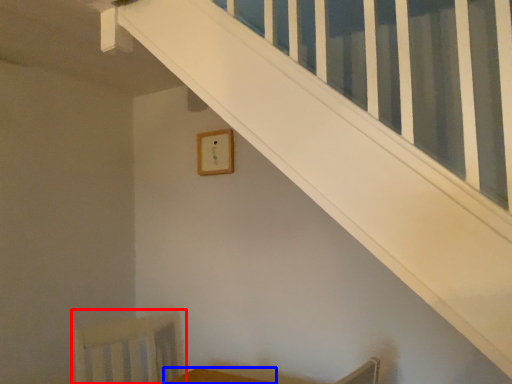
Question: Among these objects, which one is farthest to the camera, swivel chair (highlighted by a red box) or furniture (highlighted by a blue box)?

Choices:
 (A) swivel chair
 (B) furniture

Answer: (A)